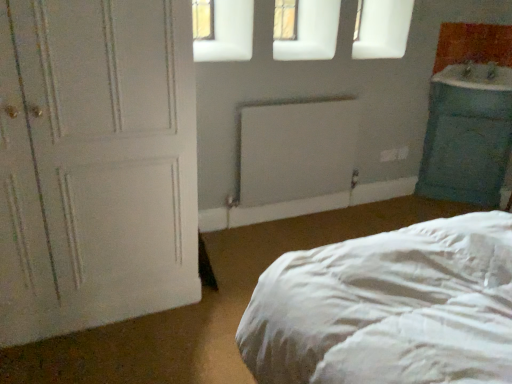
Locate an element on the screen. The width and height of the screenshot is (512, 384). vacant area that lies in front of white matte radiator at center is located at coordinates (273, 240).